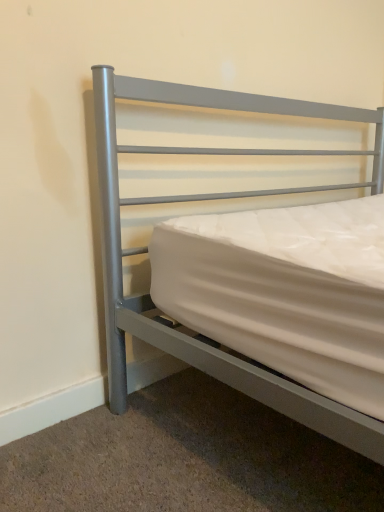
Question: Should I look upward or downward to see satin silver bed at center?

Choices:
 (A) down
 (B) up

Answer: (B)